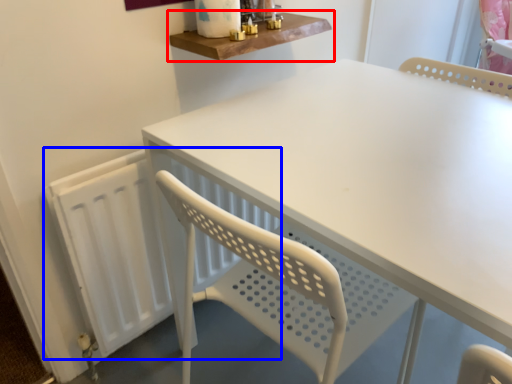
Question: Among these objects, which one is nearest to the camera, shelf (highlighted by a red box) or radiator (highlighted by a blue box)?

Choices:
 (A) shelf
 (B) radiator

Answer: (B)